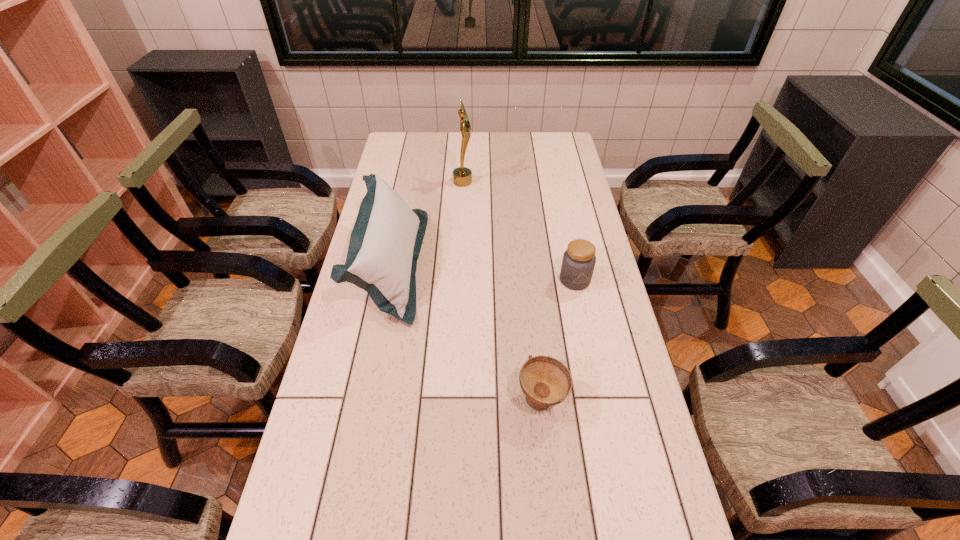
The image size is (960, 540). Identify the location of vacant space that's between the cushion and the third tallest object. (483, 272).

Identify the location of vacant area that lies between the second object from left to right and the second object from right to left. The image size is (960, 540). tap(502, 291).

I want to click on vacant space that's between the award and the jar, so click(518, 231).

In order to click on empty space between the jar and the tallest object in this screenshot , I will do `click(518, 231)`.

Locate an element on the screen. The height and width of the screenshot is (540, 960). vacant space that is in between the cushion and the rightmost object is located at coordinates (483, 272).

Identify the location of blank region between the leftmost object and the nearest object. (467, 332).

Choose which object is the third nearest neighbor to the third object from left to right. Please provide its 2D coordinates. Your answer should be formatted as a tuple, i.e. [(x, y)], where the tuple contains the x and y coordinates of a point satisfying the conditions above.

[(462, 176)]

Find the location of `object that ranks as the second closest to the jar`. object that ranks as the second closest to the jar is located at coordinates (385, 243).

Where is `vacant space that satisfies the following two spatial constraints: 1. on the front-facing side of the third object from left to right; 2. on the right side of the third object from right to left`? Image resolution: width=960 pixels, height=540 pixels. vacant space that satisfies the following two spatial constraints: 1. on the front-facing side of the third object from left to right; 2. on the right side of the third object from right to left is located at coordinates (452, 400).